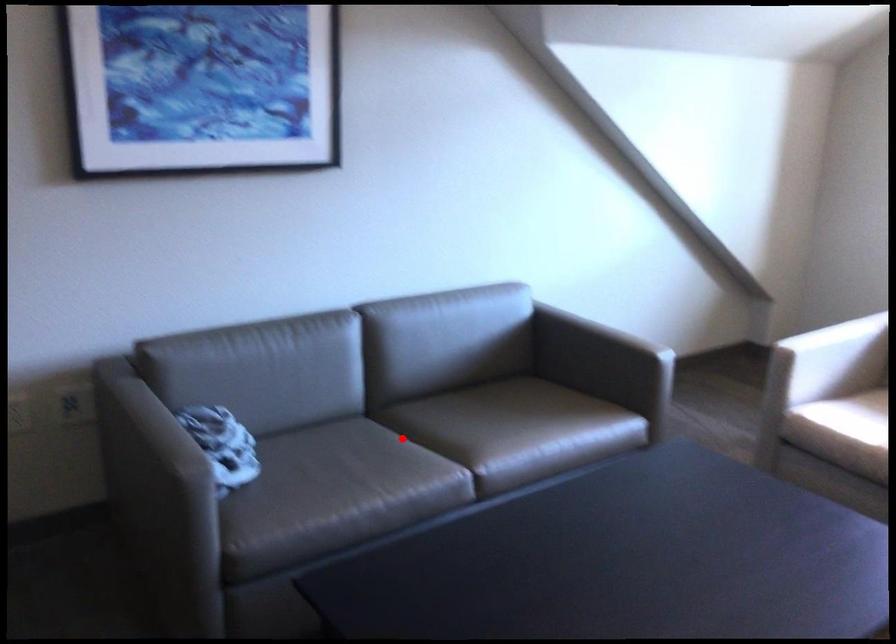
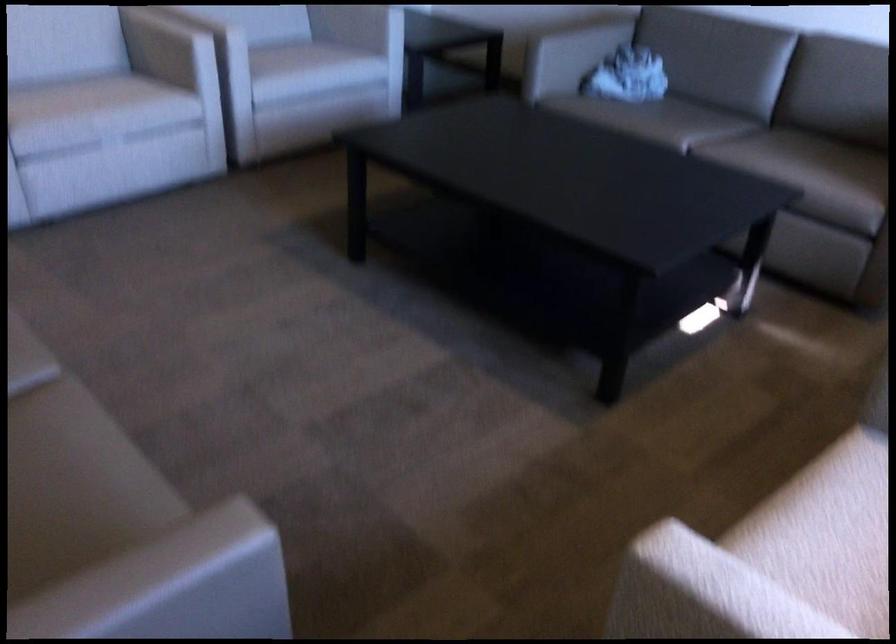
Question: I am providing you with two images of the same scene from different viewpoints. A red point is shown in image1. For the corresponding object point in image2, is it positioned nearer or farther from the camera?

Choices:
 (A) Nearer
 (B) Farther

Answer: (B)